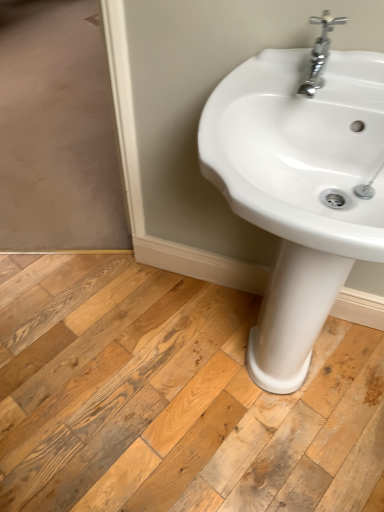
Image resolution: width=384 pixels, height=512 pixels. What are the coordinates of `free space in front of white glossy sink at center` in the screenshot? It's located at (268, 472).